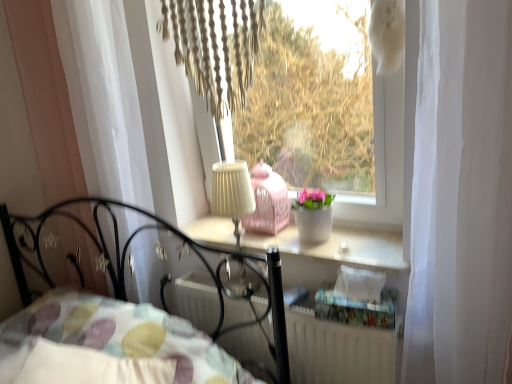
The height and width of the screenshot is (384, 512). What do you see at coordinates (232, 193) in the screenshot? I see `beige fabric lampshade at center` at bounding box center [232, 193].

Identify the location of white textured radiator at lower center. (339, 350).

In order to face white textured radiator at lower center, should I rotate leftwards or rightwards?

Turn right approximately 3.461 degrees to face it.

The image size is (512, 384). I want to click on patterned fabric pillow at lower left, so click(x=108, y=345).

Are white matte window sill at center and metallic black bed at lower left located far from each other?

Actually, white matte window sill at center and metallic black bed at lower left are a little close together.

Which is more to the right, white matte window sill at center or metallic black bed at lower left?

white matte window sill at center is more to the right.

Does white matte window sill at center have a greater height compared to metallic black bed at lower left?

No.

Considering the relative positions of patterned fabric pillow at lower left and white matte window at center in the image provided, is patterned fabric pillow at lower left in front of white matte window at center?

Yes, patterned fabric pillow at lower left is in front of white matte window at center.

From the image's perspective, which one is positioned lower, patterned fabric pillow at lower left or white matte window at center?

patterned fabric pillow at lower left, from the image's perspective.

Considering the sizes of patterned fabric pillow at lower left and white matte window at center in the image, is patterned fabric pillow at lower left taller or shorter than white matte window at center?

In the image, patterned fabric pillow at lower left appears to be shorter than white matte window at center.

Does white sheer curtain at left turn towards white matte window at center?

No, white sheer curtain at left does not turn towards white matte window at center.

Is point (71, 92) closer to viewer compared to point (397, 78)?

No, (71, 92) is further to viewer.

Which is correct: white sheer curtain at left is inside white matte window at center, or outside of it?

white sheer curtain at left is outside white matte window at center.

Would you consider white sheer curtain at left to be distant from white matte window at center?

That's right, there is a large distance between white sheer curtain at left and white matte window at center.

What are the coordinates of `curtain that is on the left side of patterned fabric pillow at lower left` in the screenshot? It's located at pos(104,98).

Between white sheer curtain at left and patterned fabric pillow at lower left, which one appears on the right side from the viewer's perspective?

Positioned to the right is patterned fabric pillow at lower left.

Is white sheer curtain at left outside of patterned fabric pillow at lower left?

That's correct, white sheer curtain at left is outside of patterned fabric pillow at lower left.

Is white sheer curtain at left looking in the opposite direction of patterned fabric pillow at lower left?

white sheer curtain at left is not turned away from patterned fabric pillow at lower left.

Which object is thinner, metallic black bed at lower left or white sheer curtain at left?

white sheer curtain at left is thinner.

Is metallic black bed at lower left touching white sheer curtain at left?

They are not placed beside each other.

How many degrees apart are the facing directions of metallic black bed at lower left and white sheer curtain at left?

The facing directions of metallic black bed at lower left and white sheer curtain at left are 1.16 degrees apart.

Which is less distant, (3, 374) or (83, 139)?

The point (3, 374) is more forward.

Which of these two, white matte window sill at center or patterned fabric pillow at lower left, stands taller?

patterned fabric pillow at lower left.

From a real-world perspective, between white matte window sill at center and patterned fabric pillow at lower left, who is vertically lower?

patterned fabric pillow at lower left is physically lower.

Considering the sizes of white matte window sill at center and patterned fabric pillow at lower left in the image, is white matte window sill at center bigger or smaller than patterned fabric pillow at lower left?

Considering their sizes, white matte window sill at center takes up less space than patterned fabric pillow at lower left.

Considering the sizes of objects white matte window sill at center and patterned fabric pillow at lower left in the image provided, who is wider, white matte window sill at center or patterned fabric pillow at lower left?

patterned fabric pillow at lower left is wider.

Is the position of white textured radiator at lower center less distant than that of patterned fabric pillow at lower left?

No, white textured radiator at lower center is further to the viewer.

Could you measure the distance between white textured radiator at lower center and patterned fabric pillow at lower left?

white textured radiator at lower center and patterned fabric pillow at lower left are 13.23 inches apart from each other.

Which is behind, point (362, 345) or point (103, 301)?

The point (103, 301) is behind.

Looking at this image, is white textured radiator at lower center oriented towards patterned fabric pillow at lower left?

Yes, white textured radiator at lower center is oriented towards patterned fabric pillow at lower left.

Where is `window sill located above the metallic black bed at lower left (from a real-world perspective)`? The image size is (512, 384). window sill located above the metallic black bed at lower left (from a real-world perspective) is located at coordinates (338, 247).

Locate an element on the screen. bedding in front of the white matte window at center is located at coordinates (108, 345).

Which object lies nearer to the anchor point metallic black bed at lower left, white sheer curtain at left or white matte window sill at center?

Among the two, white sheer curtain at left is located nearer to metallic black bed at lower left.

Looking at the image, which one is located further to white matte window at center, white sheer curtain at left or metallic black bed at lower left?

metallic black bed at lower left.

Estimate the real-world distances between objects in this image. Which object is closer to white sheer curtain at left, beige fabric lampshade at center or white matte window at center?

beige fabric lampshade at center.

From the image, which object appears to be nearer to white sheer curtain at left, white matte window at center or metallic black bed at lower left?

The object closer to white sheer curtain at left is metallic black bed at lower left.

Which object lies nearer to the anchor point metallic black bed at lower left, beige fabric lampshade at center or white sheer curtain at left?

white sheer curtain at left is closer to metallic black bed at lower left.

Estimate the real-world distances between objects in this image. Which object is further from white matte window at center, white sheer curtain at left or beige fabric lampshade at center?

beige fabric lampshade at center lies further to white matte window at center than the other object.

From the image, which object appears to be nearer to beige fabric lampshade at center, white sheer curtain at left or white matte window sill at center?

Among the two, white matte window sill at center is located nearer to beige fabric lampshade at center.

Which object lies further to the anchor point patterned fabric pillow at lower left, white matte window at center or beige fabric lampshade at center?

white matte window at center is further to patterned fabric pillow at lower left.

Locate an element on the screen. Image resolution: width=512 pixels, height=384 pixels. table lamp between patterned fabric pillow at lower left and white matte window sill at center is located at coordinates (232, 193).

Where is `curtain between metallic black bed at lower left and beige fabric lampshade at center from front to back`? The width and height of the screenshot is (512, 384). curtain between metallic black bed at lower left and beige fabric lampshade at center from front to back is located at coordinates (104, 98).

Find the location of a particular element. The image size is (512, 384). bedding between metallic black bed at lower left and white matte window sill at center from front to back is located at coordinates (108, 345).

Locate an element on the screen. bedding between white sheer curtain at left and white matte window sill at center in the horizontal direction is located at coordinates (108, 345).